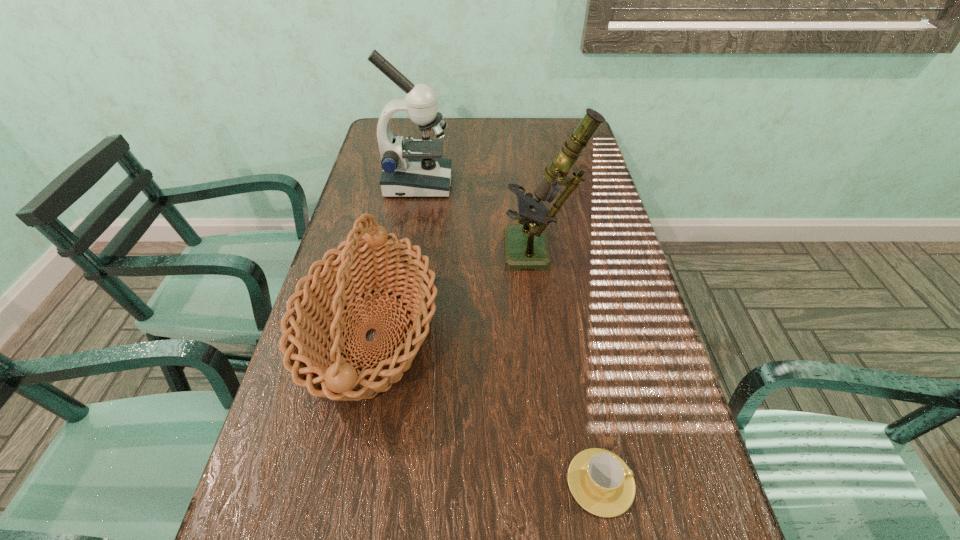
Where is `vacant area that lies between the right microscope and the farther microscope`? vacant area that lies between the right microscope and the farther microscope is located at coordinates (480, 219).

The image size is (960, 540). Find the location of `empty location between the right microscope and the farther microscope`. empty location between the right microscope and the farther microscope is located at coordinates (480, 219).

Where is `free spot between the cup and the nearer microscope`? The image size is (960, 540). free spot between the cup and the nearer microscope is located at coordinates (571, 368).

This screenshot has height=540, width=960. Identify the location of free spot between the right microscope and the second shortest object. [457, 295].

This screenshot has width=960, height=540. Identify the location of blank region between the farthest object and the cup. (509, 333).

Identify the location of vacant space that's between the right microscope and the left microscope. (480, 219).

Locate an element on the screen. The image size is (960, 540). the third closest object to the left microscope is located at coordinates (600, 481).

Image resolution: width=960 pixels, height=540 pixels. I want to click on object that is the third closest to the nearer microscope, so click(x=600, y=481).

Locate an element on the screen. free location that satisfies the following two spatial constraints: 1. at the eyepiece of the farthest object; 2. on the front side of the second shortest object is located at coordinates (392, 337).

Where is `vacant area in the image that satisfies the following two spatial constraints: 1. at the eyepiece of the farthest object; 2. on the front side of the basket`? Image resolution: width=960 pixels, height=540 pixels. vacant area in the image that satisfies the following two spatial constraints: 1. at the eyepiece of the farthest object; 2. on the front side of the basket is located at coordinates (392, 337).